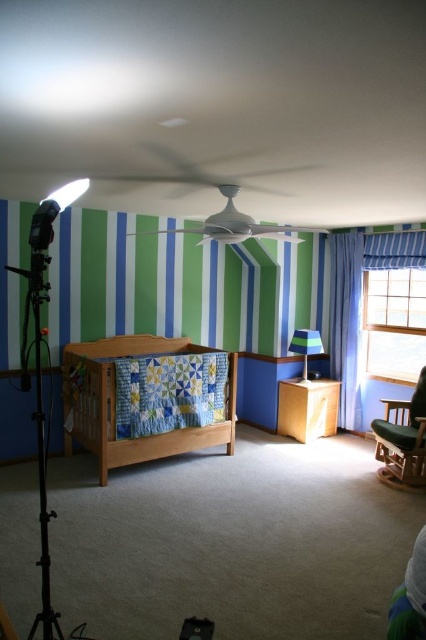
Can you confirm if wooden crib at center is thinner than green fabric lampshade at center?

No.

Is wooden crib at center wider than green fabric lampshade at center?

Yes.

Measure the distance between point (71,448) and camera.

They are 4.48 meters apart.

At what (x,y) coordinates should I click in order to perform the action: click on wooden crib at center. Please return your answer as a coordinate pair (x, y). This screenshot has width=426, height=640. Looking at the image, I should click on (115, 403).

Image resolution: width=426 pixels, height=640 pixels. What do you see at coordinates (115, 403) in the screenshot?
I see `wooden crib at center` at bounding box center [115, 403].

Which is more to the left, wooden crib at center or blue fabric curtain at right?

wooden crib at center is more to the left.

Which is behind, point (192, 451) or point (347, 248)?

Positioned behind is point (347, 248).

Image resolution: width=426 pixels, height=640 pixels. In order to click on wooden crib at center in this screenshot , I will do `click(115, 403)`.

Can you confirm if green fabric armchair at right is wider than green fabric lampshade at center?

Yes, green fabric armchair at right is wider than green fabric lampshade at center.

This screenshot has width=426, height=640. What do you see at coordinates (402, 440) in the screenshot?
I see `green fabric armchair at right` at bounding box center [402, 440].

At what (x,y) coordinates should I click in order to perform the action: click on green fabric armchair at right. Please return your answer as a coordinate pair (x, y). The image size is (426, 640). Looking at the image, I should click on (402, 440).